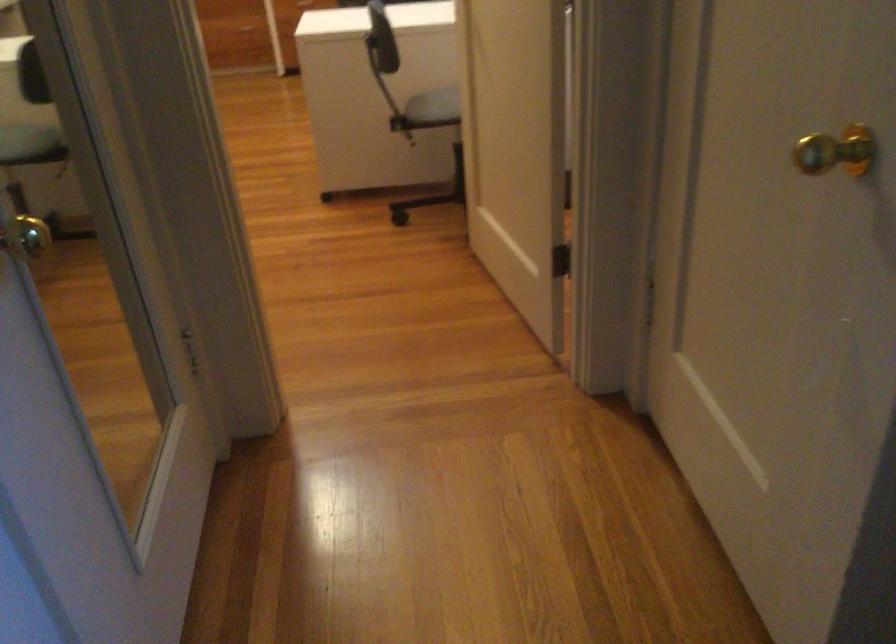
At what (x,y) coordinates should I click in order to perform the action: click on chair sitting surface. Please return your answer as a coordinate pair (x, y). The height and width of the screenshot is (644, 896). Looking at the image, I should click on (434, 106).